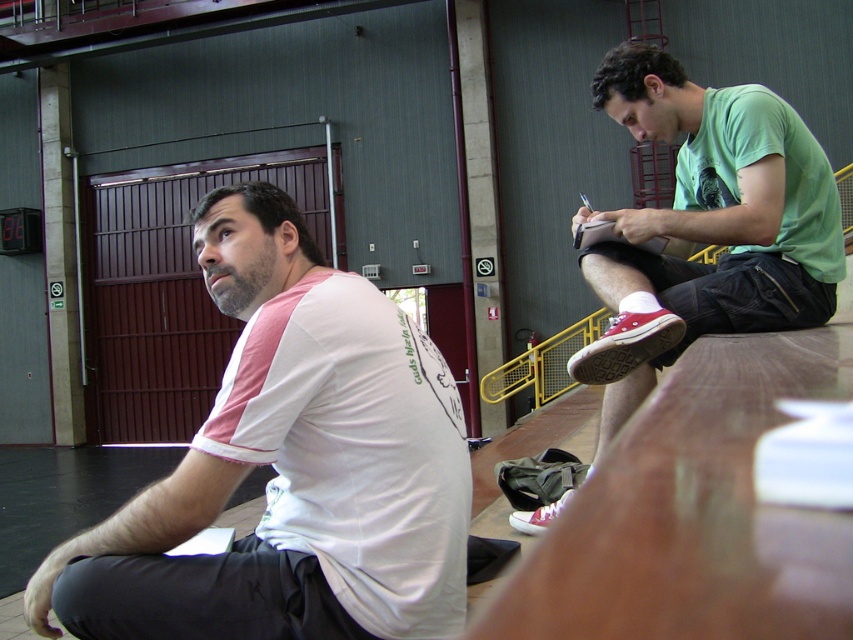
You are standing in the gymnasium and need to locate the green matte shirt at upper right. According to the coordinates provided, where exactly is it positioned?

The green matte shirt at upper right is located at point 0.355 on the x axis and 0.828 on the y axis.

You are standing in the gymnasium and need to place a small object between the white fabric shirt at left and the red canvas shoe at lower right. Can you do this without moving either of them?

Yes, since the white fabric shirt at left is to the left of the red canvas shoe at lower right, there is space between them to place the small object without moving either.